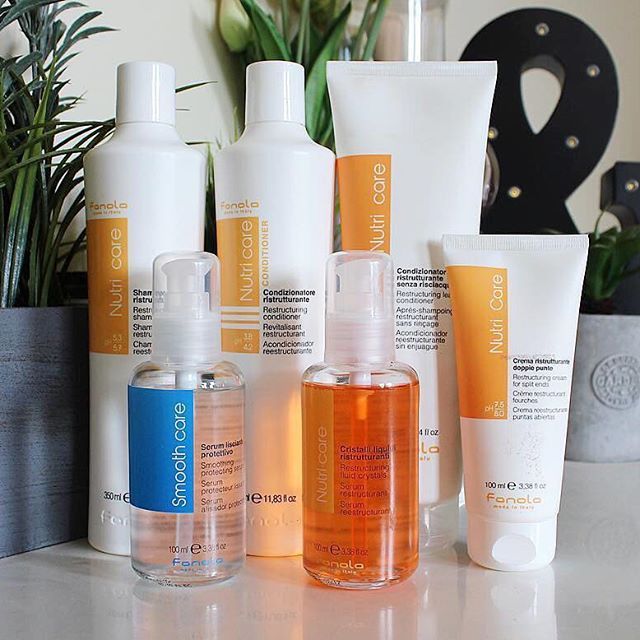
I want to click on bottle lids, so point(144,93), point(269,86), point(166,283), point(339,288).